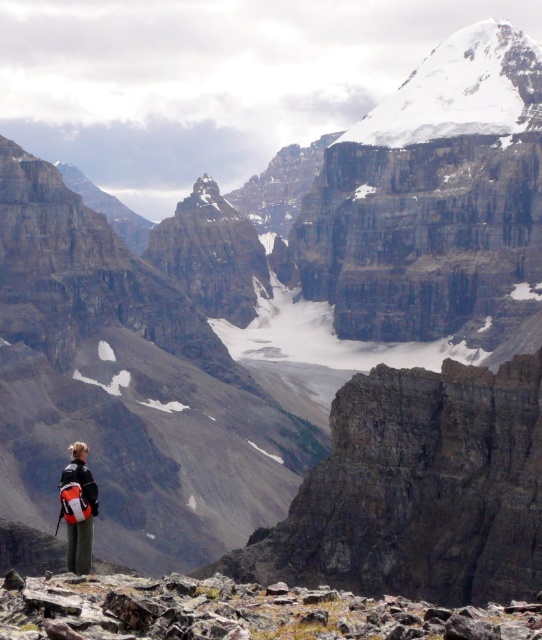
Question: Which point is farther to the camera?

Choices:
 (A) rusty rock at lower left
 (B) white snow-covered peak at upper center

Answer: (B)

Question: Which of the following is the closest to the observer?

Choices:
 (A) rusty rock at lower left
 (B) white snow-covered peak at upper center

Answer: (A)

Question: Observing the image, what is the correct spatial positioning of rusty rock at lower left in reference to matte black backpack at lower left?

Choices:
 (A) below
 (B) above

Answer: (A)

Question: Is rusty rock at lower left bigger than matte black backpack at lower left?

Choices:
 (A) no
 (B) yes

Answer: (B)

Question: Which point is farther to the camera?

Choices:
 (A) rusty rock at lower left
 (B) matte black backpack at lower left
 (C) white snow-covered peak at upper center

Answer: (C)

Question: Can you confirm if rusty rock at lower left is thinner than white snow-covered peak at upper center?

Choices:
 (A) yes
 (B) no

Answer: (A)